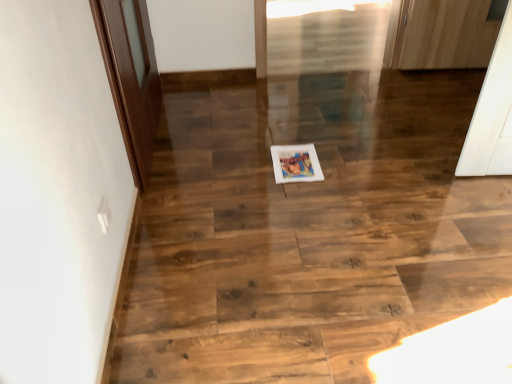
Where is `free space in front of matte paper postcard at center`? The image size is (512, 384). free space in front of matte paper postcard at center is located at coordinates (293, 188).